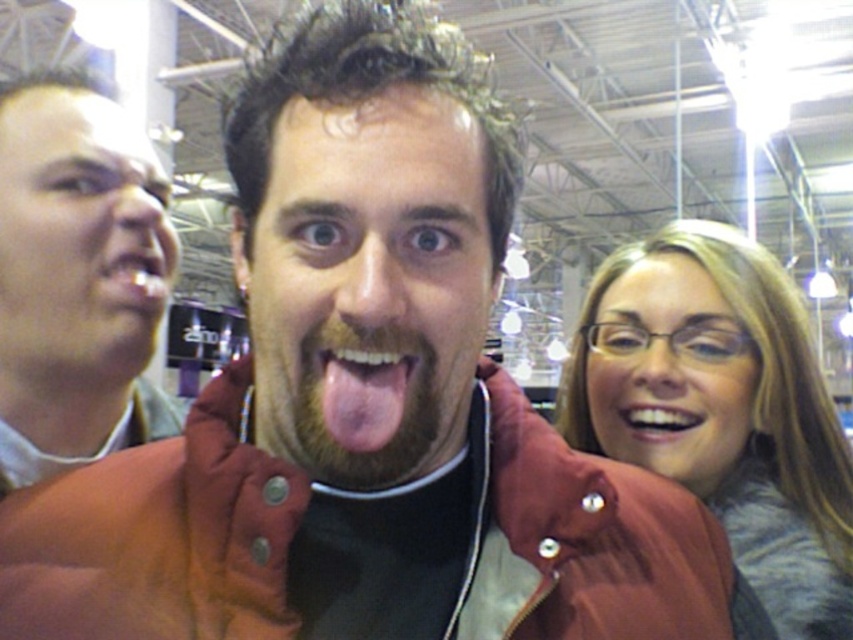
Between matte gray sweater at right and pink flesh-colored tongue at center, which one is positioned lower?

matte gray sweater at right is below.

Is point (643, 292) more distant than point (355, 374)?

Yes.

Does point (693, 241) lie behind point (367, 365)?

Yes.

Locate an element on the screen. This screenshot has height=640, width=853. matte gray sweater at right is located at coordinates (724, 410).

Is pink flesh-colored tongue at center in front of white glossy teeth at center?

Yes, it is.

Locate an element on the screen. This screenshot has height=640, width=853. pink flesh-colored tongue at center is located at coordinates (367, 394).

Which is behind, point (825, 529) or point (669, 442)?

The point (669, 442) is behind.

Where is `matte gray sweater at right`? The width and height of the screenshot is (853, 640). matte gray sweater at right is located at coordinates (724, 410).